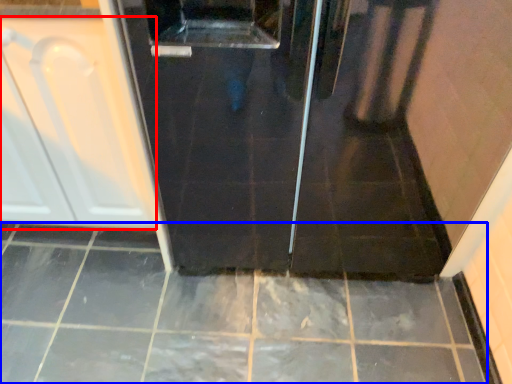
Question: Which object is further to the camera taking this photo, cabinetry (highlighted by a red box) or ceramic tile (highlighted by a blue box)?

Choices:
 (A) cabinetry
 (B) ceramic tile

Answer: (B)